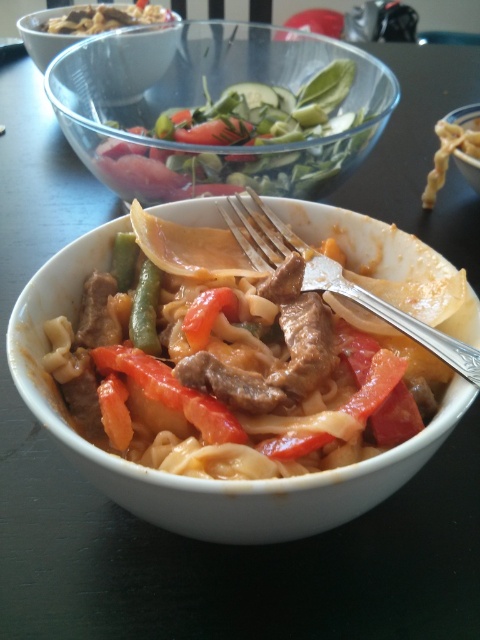
Is silver metallic fork at center below red matte tomato at center?

No.

Does silver metallic fork at center lie behind red matte tomato at center?

No, it is not.

Which is behind, point (468, 378) or point (203, 310)?

The point (203, 310) is more distant.

You are a GUI agent. You are given a task and a screenshot of the screen. Output one action in this format:
    pyautogui.click(x=<x>, y=<y>)
    Task: Click on the silver metallic fork at center
    The height and width of the screenshot is (640, 480).
    Given the screenshot: What is the action you would take?
    pyautogui.click(x=333, y=276)

Does matte ceramic bowl at center appear on the left side of silver metallic fork at center?

Yes, matte ceramic bowl at center is to the left of silver metallic fork at center.

Who is higher up, matte ceramic bowl at center or silver metallic fork at center?

Positioned higher is silver metallic fork at center.

Measure the distance between point [85,275] and camera.

32.31 inches

Locate an element on the screen. This screenshot has height=640, width=480. matte ceramic bowl at center is located at coordinates (201, 477).

Which is more to the left, matte white bowl at upper center or red matte tomato at center?

matte white bowl at upper center

Does matte white bowl at upper center have a lesser height compared to red matte tomato at center?

No.

The width and height of the screenshot is (480, 640). What are the coordinates of `matte white bowl at upper center` in the screenshot? It's located at (81, 26).